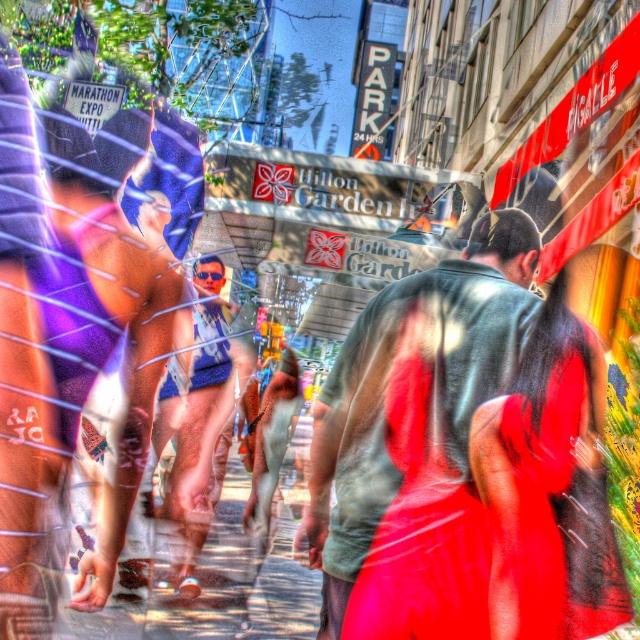
Does green fabric shirt at center come in front of smooth concrete sidewalk at center?

Yes, green fabric shirt at center is in front of smooth concrete sidewalk at center.

Which is behind, point (504, 374) or point (140, 609)?

Point (140, 609)

Find the location of a particular element. This screenshot has height=640, width=640. green fabric shirt at center is located at coordinates (435, 385).